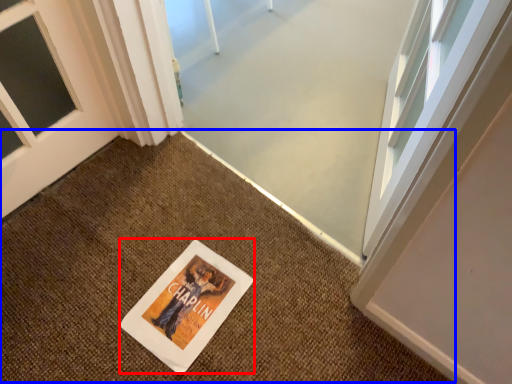
Question: Which object is closer to the camera taking this photo, flyer (highlighted by a red box) or doormat (highlighted by a blue box)?

Choices:
 (A) flyer
 (B) doormat

Answer: (B)